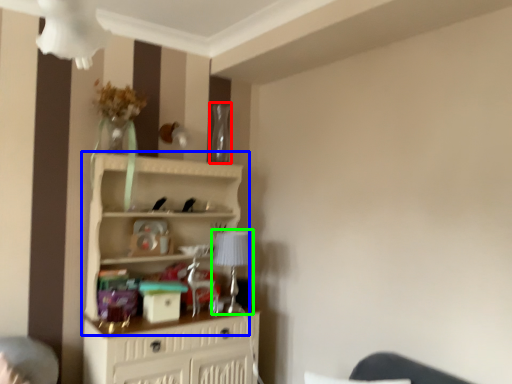
Question: Which object is the farthest from glass vase (highlighted by a red box)? Choose among these: shelf (highlighted by a blue box) or table lamp (highlighted by a green box).

Choices:
 (A) shelf
 (B) table lamp

Answer: (B)